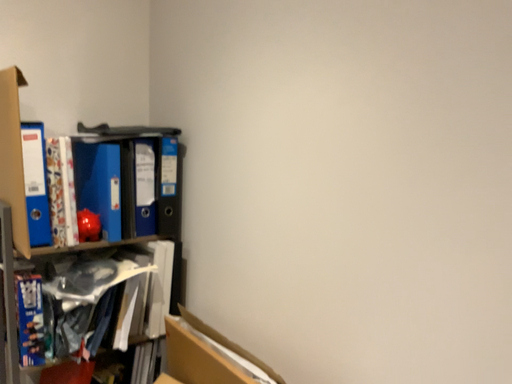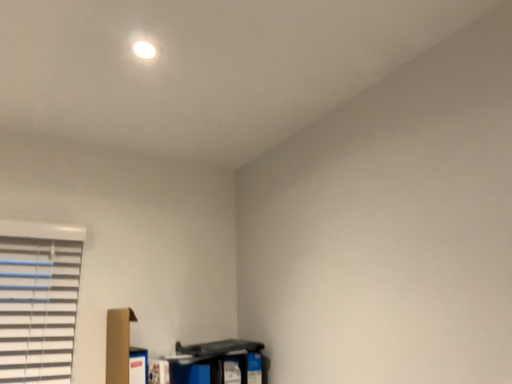
Question: How did the camera likely rotate when shooting the video?

Choices:
 (A) rotated upward
 (B) rotated downward

Answer: (A)